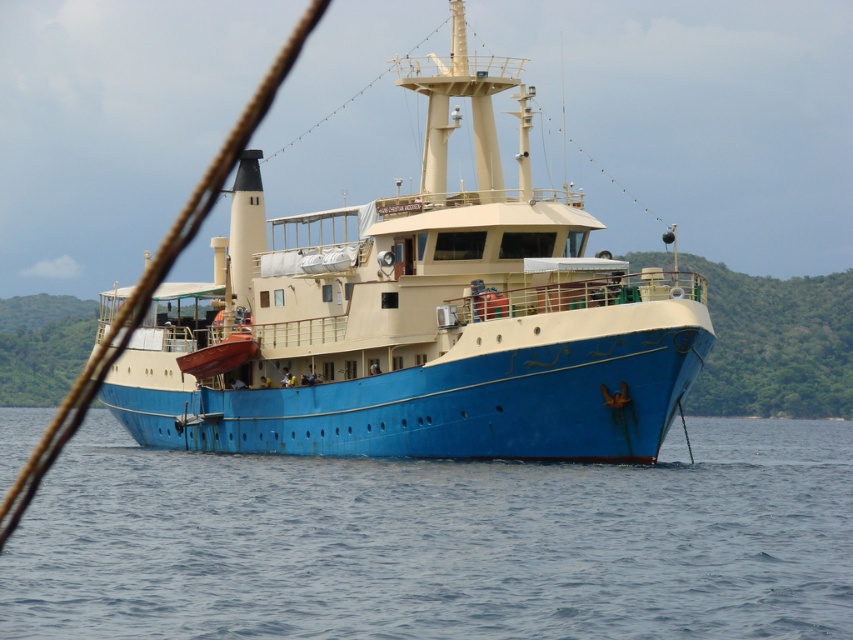
Who is more forward, [550,628] or [340,240]?

Positioned in front is point [550,628].

Does blue matte water at lower center appear on the right side of blue matte boat at center?

Indeed, blue matte water at lower center is positioned on the right side of blue matte boat at center.

Does point (454, 612) come closer to viewer compared to point (558, 440)?

Yes.

Image resolution: width=853 pixels, height=640 pixels. What are the coordinates of `blue matte water at lower center` in the screenshot? It's located at (440, 541).